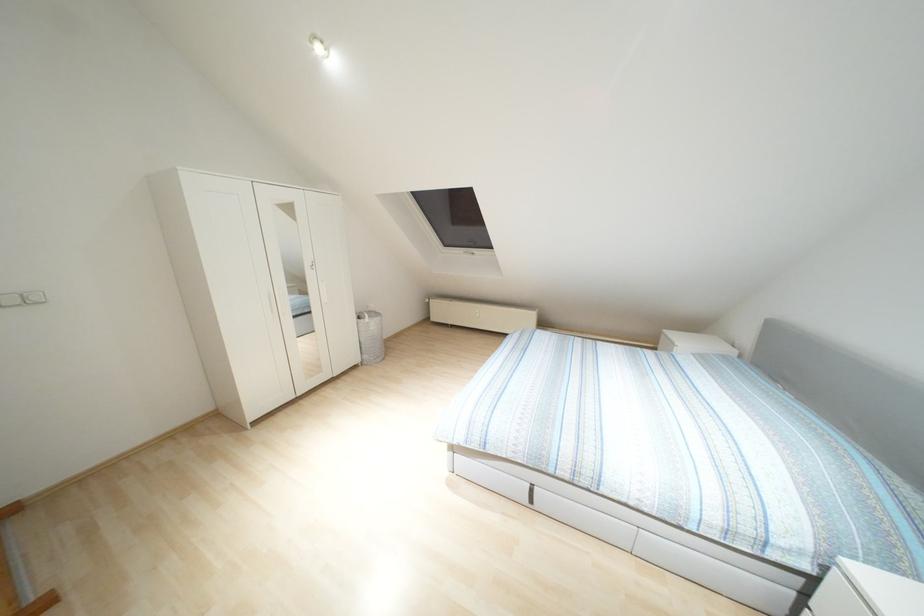
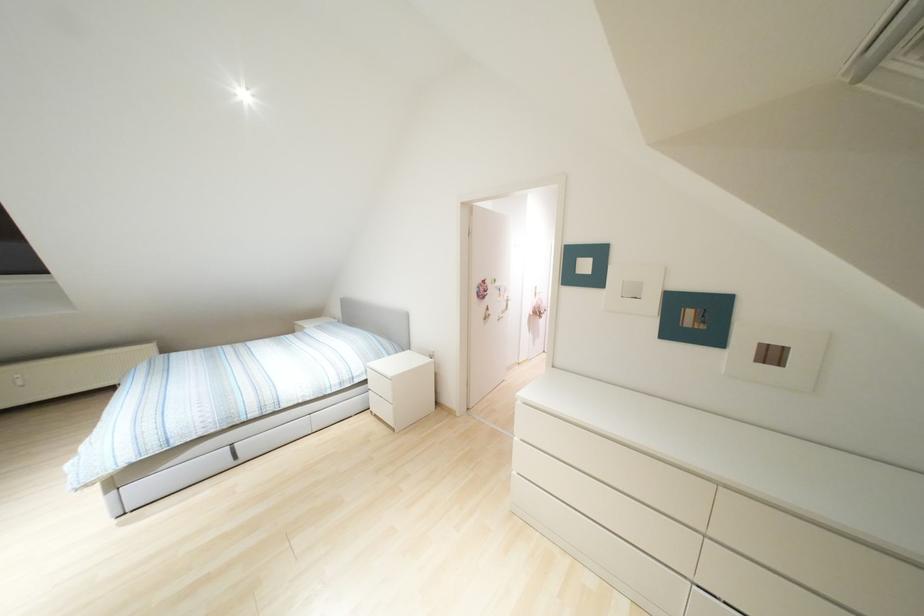
Locate, in the second image, the point that corresponds to point (531, 500) in the first image.

(235, 456)